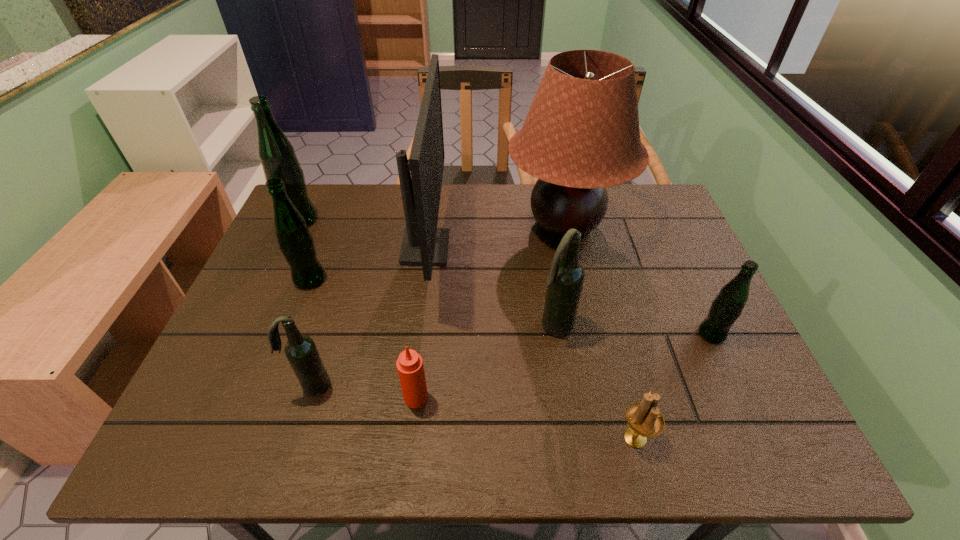
I want to click on beer bottle at the right edge, so click(726, 308).

You are a GUI agent. You are given a task and a screenshot of the screen. Output one action in this format:
    pyautogui.click(x=<x>, y=<y>)
    Task: Click on the object that is positioned at the far left corner
    
    Given the screenshot: What is the action you would take?
    pyautogui.click(x=277, y=155)

Where is `object at the far right corner`? object at the far right corner is located at coordinates (581, 134).

The image size is (960, 540). In the image, there is a desktop. Find the location of `vacant space at the far edge`. vacant space at the far edge is located at coordinates (389, 209).

In the image, there is a desktop. Find the location of `vacant region at the near edge`. vacant region at the near edge is located at coordinates (362, 457).

The width and height of the screenshot is (960, 540). In the image, there is a desktop. In order to click on free space at the left edge in this screenshot , I will do `click(276, 269)`.

You are a GUI agent. You are given a task and a screenshot of the screen. Output one action in this format:
    pyautogui.click(x=<x>, y=<y>)
    Task: Click on the vacant space at the right edge
    This screenshot has width=960, height=540.
    Given the screenshot: What is the action you would take?
    pyautogui.click(x=672, y=320)

Identify the location of vacant space at the far right corner of the desktop. The width and height of the screenshot is (960, 540). (629, 230).

The width and height of the screenshot is (960, 540). Identify the location of empty location between the nearest green beer bottle and the brown lampshade. (638, 280).

You are a GUI agent. You are given a task and a screenshot of the screen. Output one action in this format:
    pyautogui.click(x=<x>, y=<y>)
    Task: Click on the vacant region between the nearest object and the leftmost object
    This screenshot has width=960, height=540.
    Given the screenshot: What is the action you would take?
    pyautogui.click(x=468, y=329)